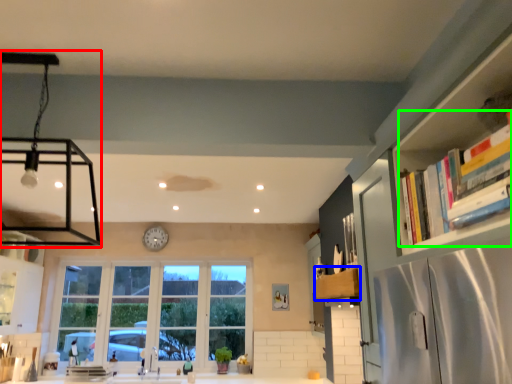
Question: Estimate the real-world distances between objects in this image. Which object is farther from light fixture (highlighted by a red box), cabinetry (highlighted by a blue box) or book (highlighted by a green box)?

Choices:
 (A) cabinetry
 (B) book

Answer: (B)